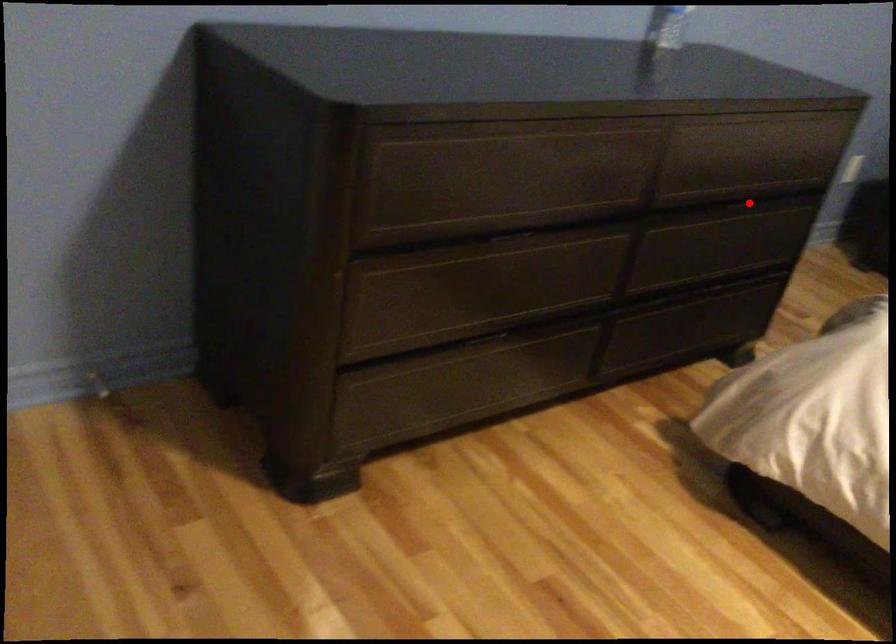
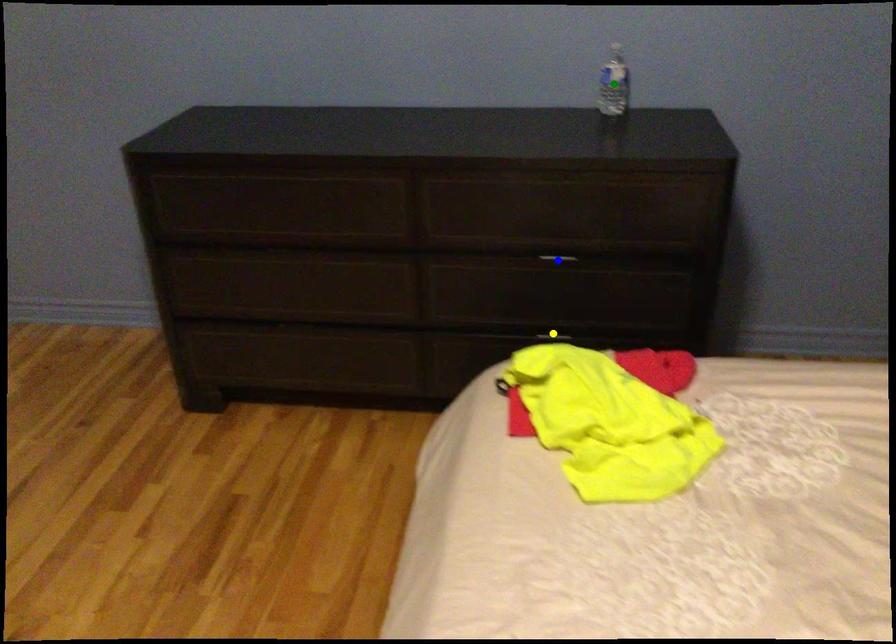
Question: I am providing you with two images of the same scene from different viewpoints. A red point is marked on the first image. You are given multiple points on the second image. Which spot in image 2 lines up with the point in image 1?

Choices:
 (A) blue point
 (B) yellow point
 (C) green point

Answer: (A)